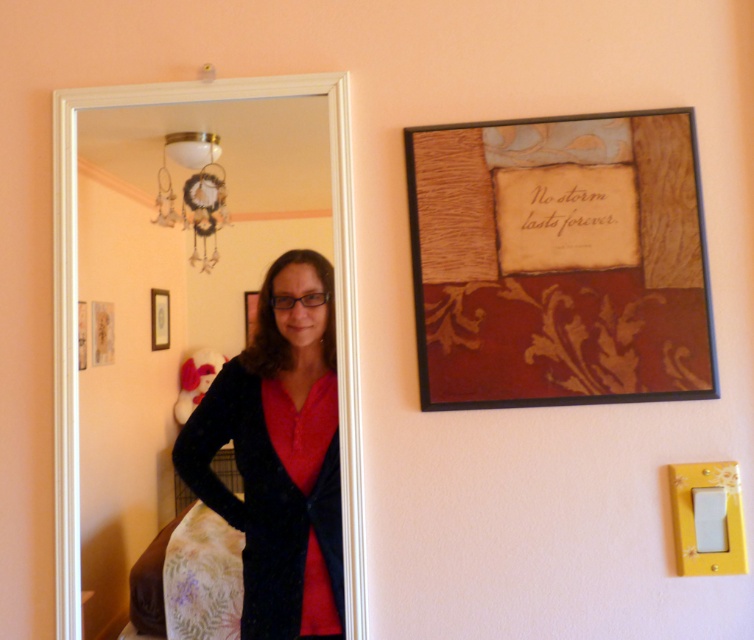
How much distance is there between wooden picture frame at center and matte black picture frame at center?

wooden picture frame at center is 19.98 inches from matte black picture frame at center.

Between point (155, 346) and point (253, 307), which one is positioned behind?

Point (253, 307)

Is point (166, 294) positioned before point (256, 323)?

No, (166, 294) is further to viewer.

Where is `wooden picture frame at center`? The image size is (754, 640). wooden picture frame at center is located at coordinates 158,317.

Is point (500, 312) more distant than point (155, 336)?

That is False.

Does wooden plaque at upper right appear on the left side of wooden picture frame at center?

In fact, wooden plaque at upper right is to the right of wooden picture frame at center.

Who is more distant from viewer, [520,157] or [164,296]?

The point [164,296] is more distant.

Where is `wooden plaque at upper right`? wooden plaque at upper right is located at coordinates (559, 260).

Is velvet black cardigan at left below matte black picture frame at center?

Yes.

Does point (296, 353) lie in front of point (247, 312)?

Yes.

I want to click on velvet black cardigan at left, so click(279, 456).